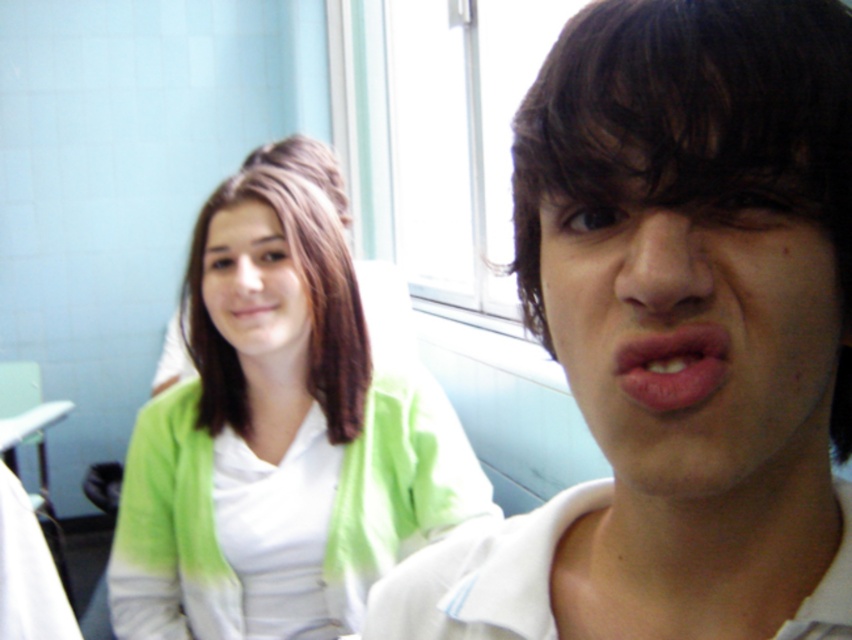
Is matte skin face at center further to camera compared to matte green cardigan at upper left?

No, it is in front of matte green cardigan at upper left.

Is matte skin face at center bigger than matte green cardigan at upper left?

Indeed, matte skin face at center has a larger size compared to matte green cardigan at upper left.

This screenshot has width=852, height=640. What do you see at coordinates (695, 163) in the screenshot?
I see `matte skin face at center` at bounding box center [695, 163].

This screenshot has width=852, height=640. I want to click on matte skin face at center, so click(x=695, y=163).

In the scene shown: Does green fabric cardigan at upper left have a greater height compared to matte white mouth at center?

Yes.

Does green fabric cardigan at upper left have a larger size compared to matte white mouth at center?

Yes, green fabric cardigan at upper left is bigger than matte white mouth at center.

The image size is (852, 640). Identify the location of green fabric cardigan at upper left. (280, 433).

Find the location of a particular element. pink matte lips at center is located at coordinates (672, 365).

Does point (704, 337) come behind point (239, 301)?

That is False.

What are the coordinates of `pink matte lips at center` in the screenshot? It's located at (672, 365).